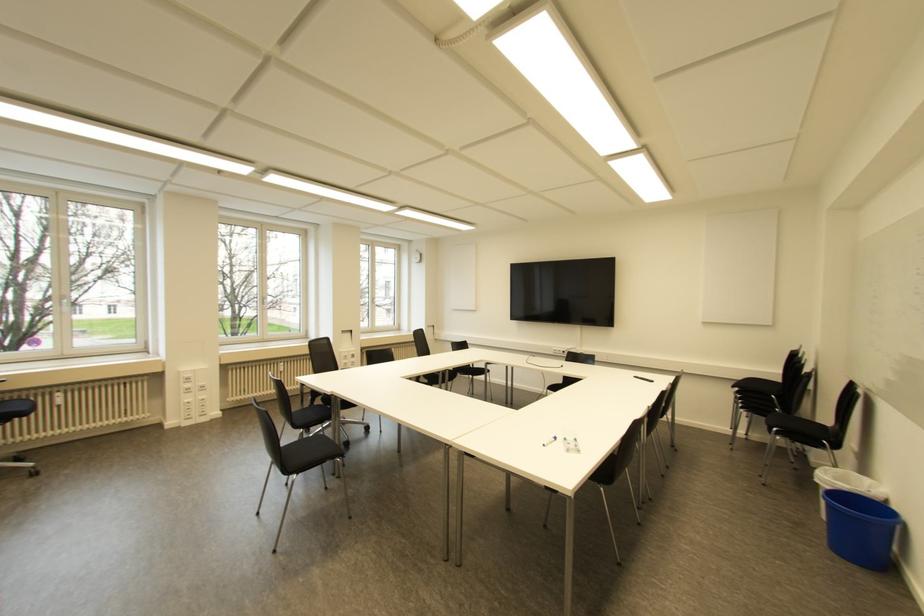
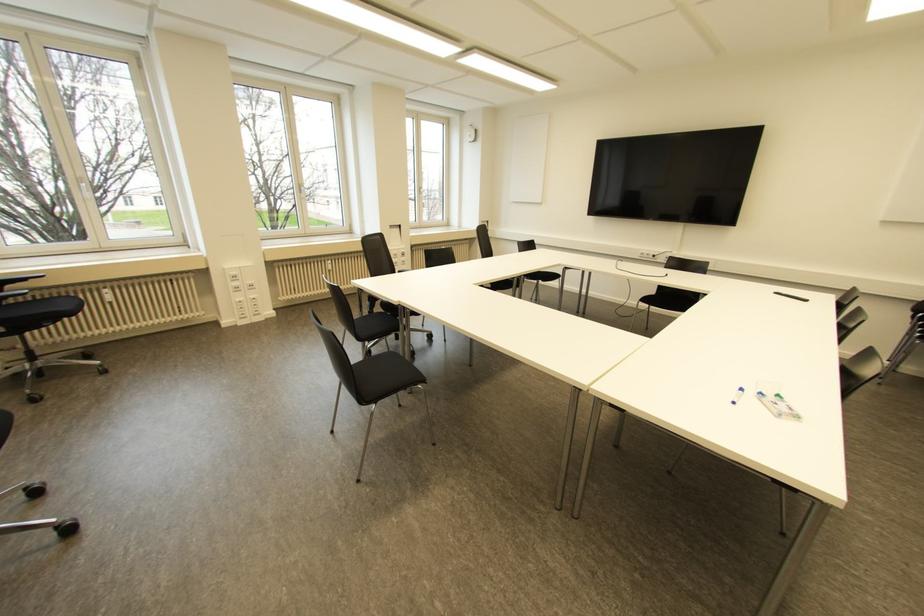
In the second image, find the point that corresponds to (576,439) in the first image.

(777, 395)